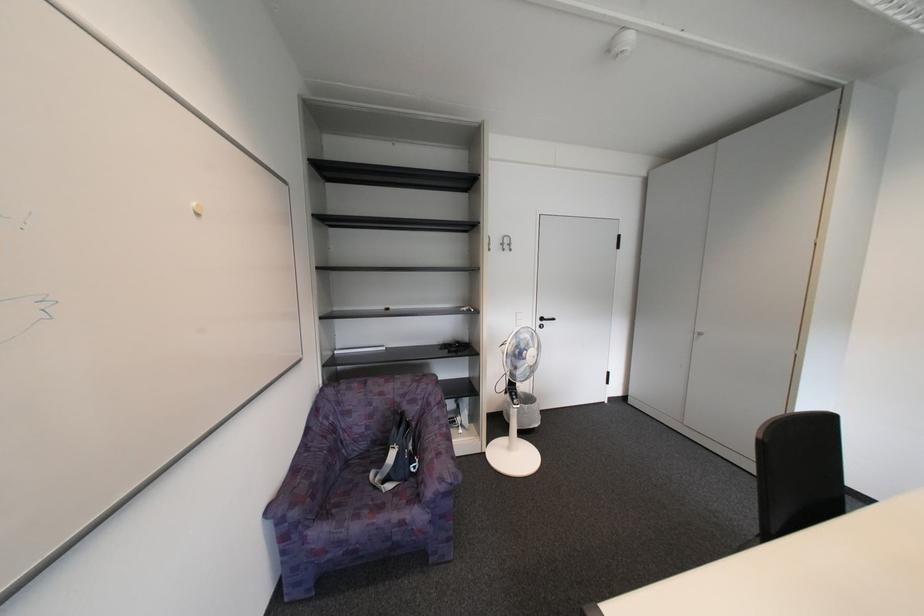
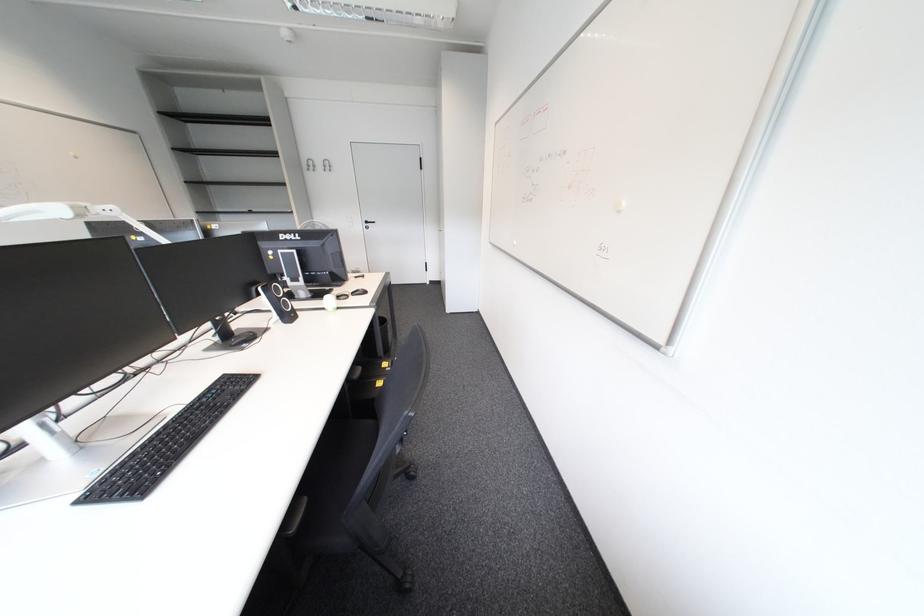
Which direction would the cameraman need to move to produce the second image?

The cameraman walked toward right, backward.